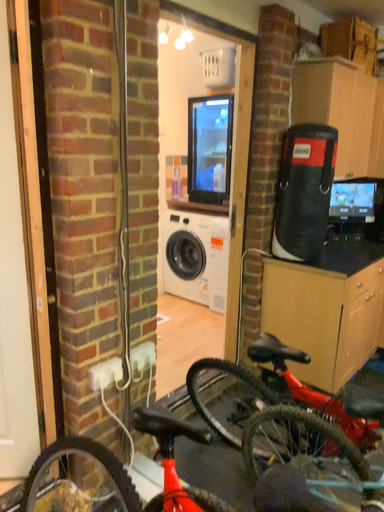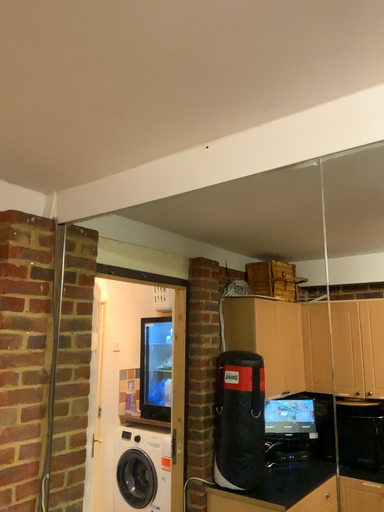
Question: Which way did the camera rotate in the video?

Choices:
 (A) rotated upward
 (B) rotated downward

Answer: (A)